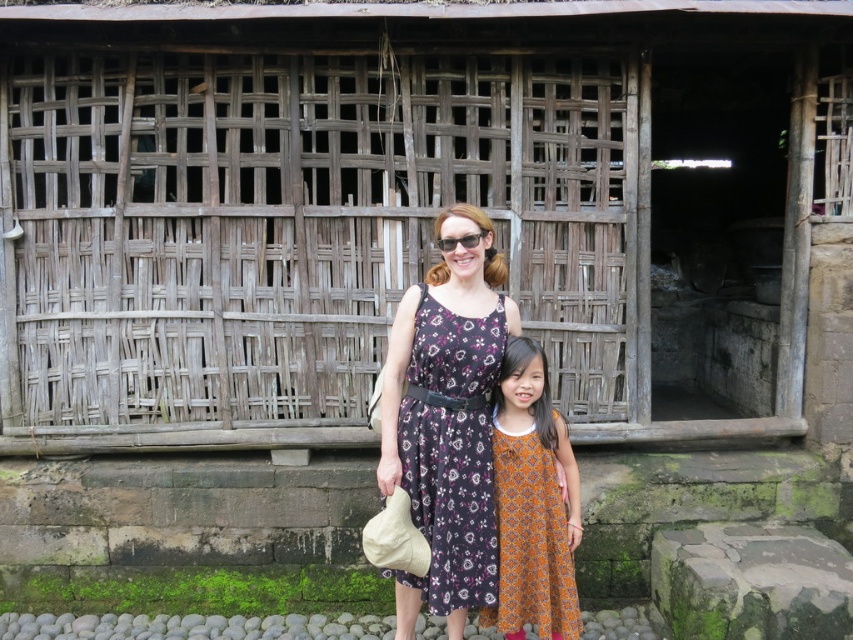
You are a photographer setting up a shoot in front of the rustic wooden structure. You need to ensure that the orange printed dress at center and the matte black sunglasses at center are both visible in the frame. Based on their sizes, which object should you prioritize positioning closer to the camera to maintain clarity?

The orange printed dress at center is taller than the matte black sunglasses at center. To ensure both are visible, prioritize positioning the matte black sunglasses at center closer to the camera since it is smaller and might need better focus to be clear in the photo.